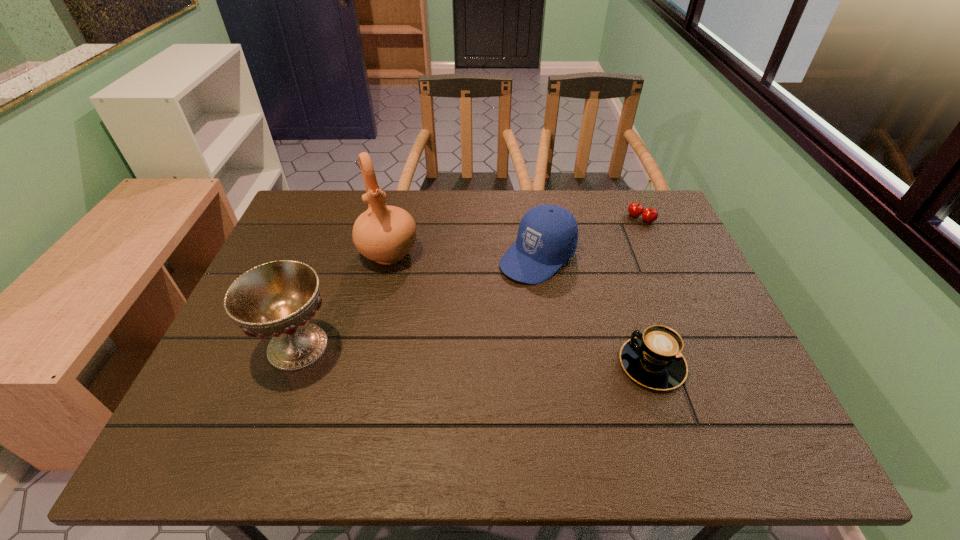
This screenshot has width=960, height=540. What are the coordinates of `the second tallest object` in the screenshot? It's located at coord(276,299).

Find the location of a particular element. the shortest object is located at coordinates (653, 358).

Identify the location of the second object from right to left. (653, 358).

Locate an element on the screen. the rightmost object is located at coordinates (635, 209).

Identify the location of cherry. The width and height of the screenshot is (960, 540). (635, 209).

The height and width of the screenshot is (540, 960). I want to click on the tallest object, so click(x=385, y=234).

At what (x,y) coordinates should I click in order to perform the action: click on cap. Please return your answer as a coordinate pair (x, y). This screenshot has height=540, width=960. Looking at the image, I should click on (547, 237).

This screenshot has width=960, height=540. What are the coordinates of `vacant space situated on the right of the chalice` in the screenshot? It's located at (376, 346).

Locate an element on the screen. The width and height of the screenshot is (960, 540). free space located 0.330m on the back of the shortest object is located at coordinates (612, 246).

Where is `free spot located 0.200m with the stems of the farthest object pointing upwards`? This screenshot has height=540, width=960. free spot located 0.200m with the stems of the farthest object pointing upwards is located at coordinates (604, 256).